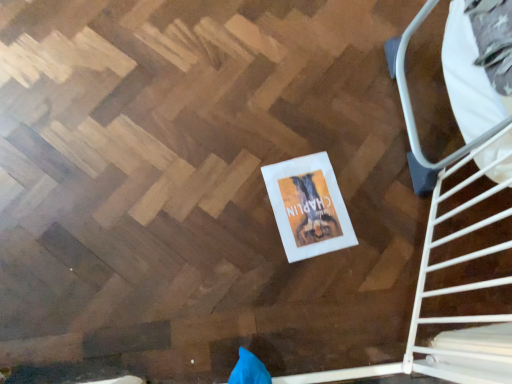
Identify the location of free space to the left of white metal gate at upper right. The image size is (512, 384). (308, 249).